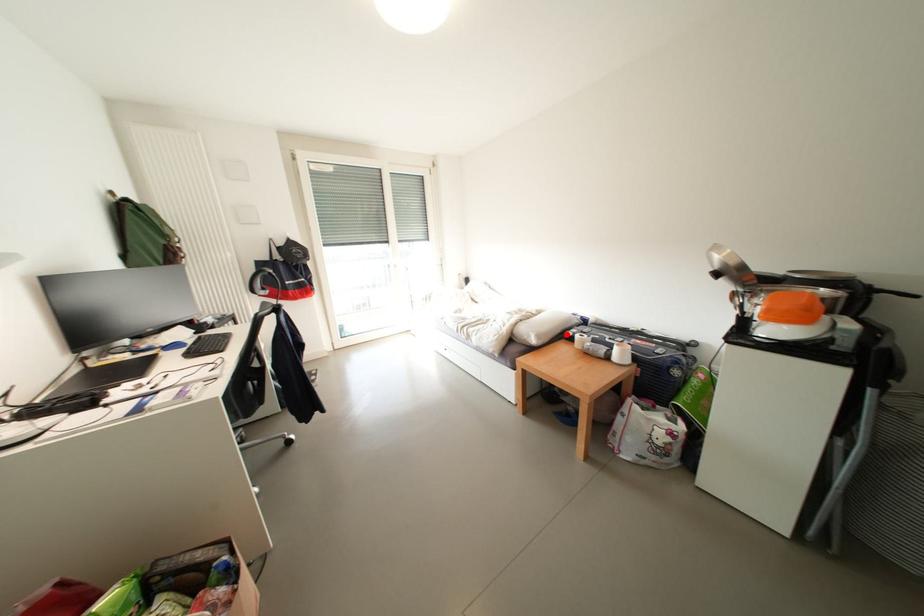
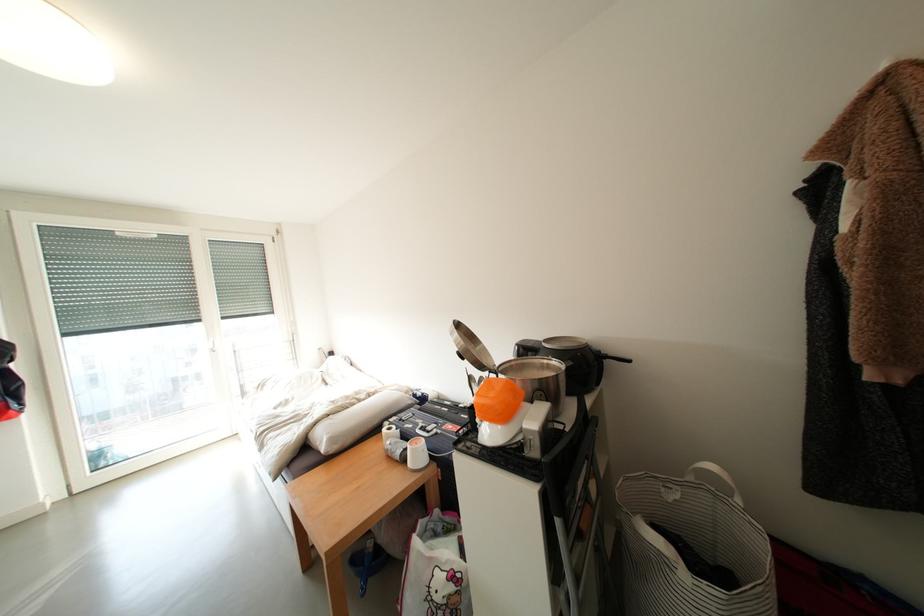
In the second image, find the point that corresponds to the highlighted location in the first image.

(383, 426)